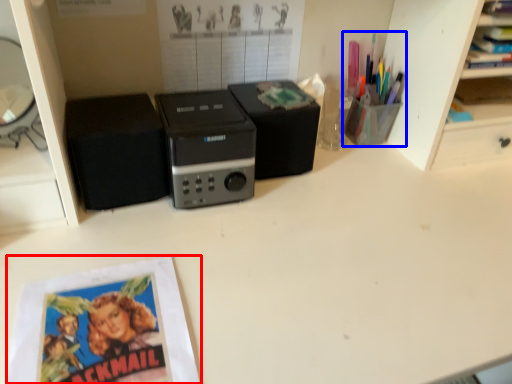
Question: Which point is closer to the camera, paperback book (highlighted by a red box) or stationery (highlighted by a blue box)?

Choices:
 (A) paperback book
 (B) stationery

Answer: (A)